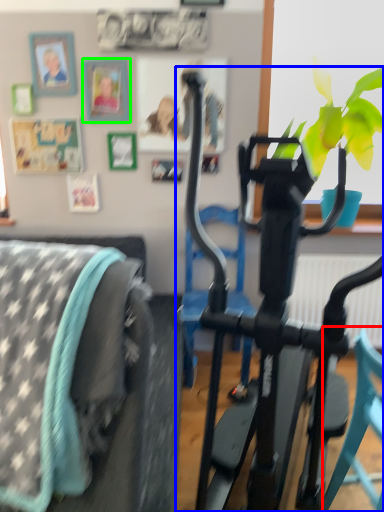
Question: Based on their relative distances, which object is farther from chair (highlighted by a red box)? Choose from stationary bicycle (highlighted by a blue box) and picture frame (highlighted by a green box).

Choices:
 (A) stationary bicycle
 (B) picture frame

Answer: (B)